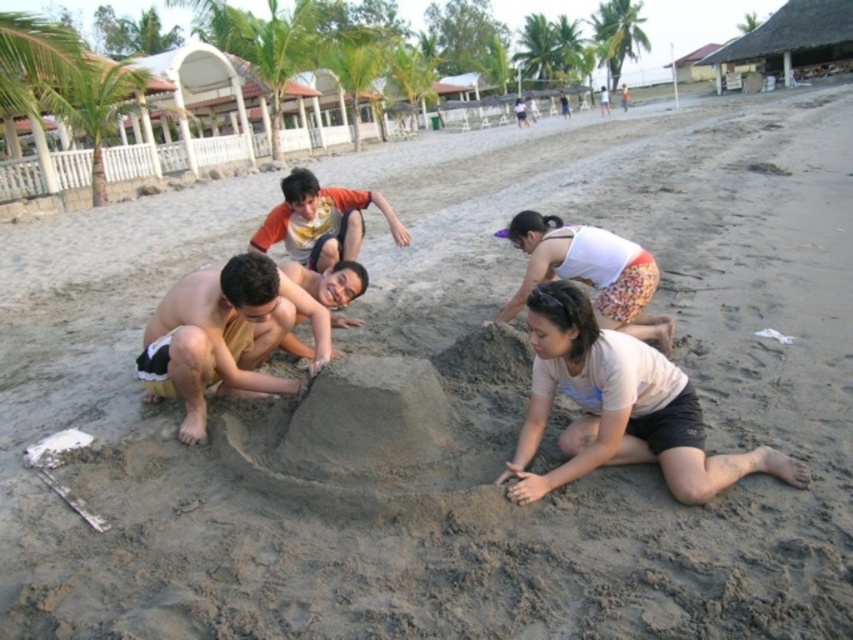
Question: Which object appears closest to the camera in this image?

Choices:
 (A) white cotton tank top at lower center
 (B) tan skin man at center

Answer: (B)

Question: Which object is positioned farthest from the light beige cotton shirt at lower right?

Choices:
 (A) tan skin man at center
 (B) white cotton tank top at lower center

Answer: (A)

Question: Does tan skin man at center have a greater width compared to white cotton tank top at lower center?

Choices:
 (A) yes
 (B) no

Answer: (A)

Question: Which object is positioned closest to the tan skin man at center?

Choices:
 (A) light beige cotton shirt at lower right
 (B) white cotton tank top at lower center

Answer: (A)

Question: Can you confirm if tan skin man at center is bigger than white cotton tank top at lower center?

Choices:
 (A) yes
 (B) no

Answer: (A)

Question: Can you confirm if light beige cotton shirt at lower right is smaller than tan skin man at center?

Choices:
 (A) no
 (B) yes

Answer: (B)